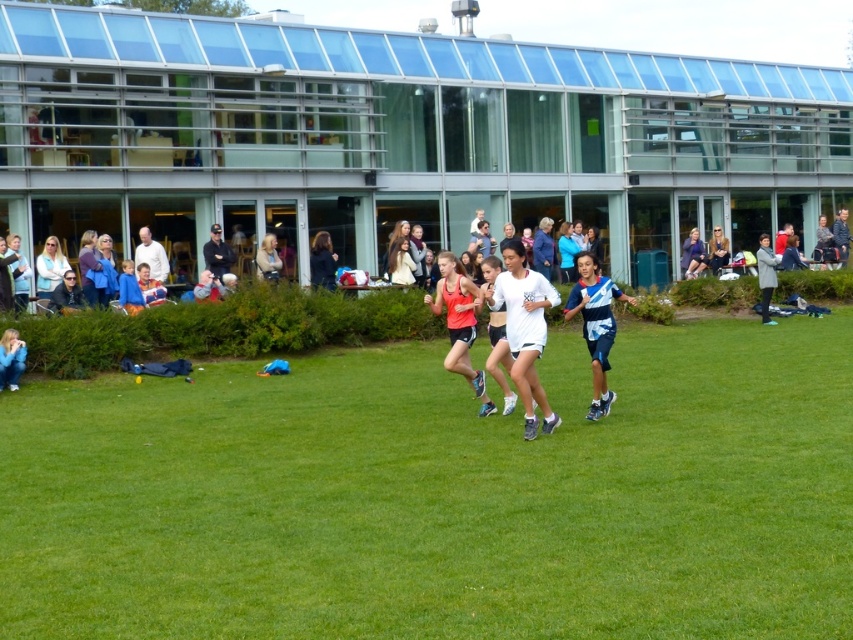
Does blue fuzzy jacket at lower left appear on the left side of dark blue jacket at center?

Yes, blue fuzzy jacket at lower left is to the left of dark blue jacket at center.

Locate an element on the screen. blue fuzzy jacket at lower left is located at coordinates (10, 358).

The image size is (853, 640). Identify the location of blue fuzzy jacket at lower left. (10, 358).

Is point (535, 296) behind point (579, 269)?

No, (535, 296) is closer to viewer.

Is point (521, 381) in front of point (583, 291)?

That is True.

Locate an element on the screen. white matte tank top at center is located at coordinates click(525, 330).

Does dark blue jacket at center lie in front of blue denim jacket at center?

Yes.

This screenshot has height=640, width=853. Describe the element at coordinates (322, 260) in the screenshot. I see `dark blue jacket at center` at that location.

The width and height of the screenshot is (853, 640). What do you see at coordinates (322, 260) in the screenshot? I see `dark blue jacket at center` at bounding box center [322, 260].

The image size is (853, 640). Find the location of `dark blue jacket at center`. dark blue jacket at center is located at coordinates (322, 260).